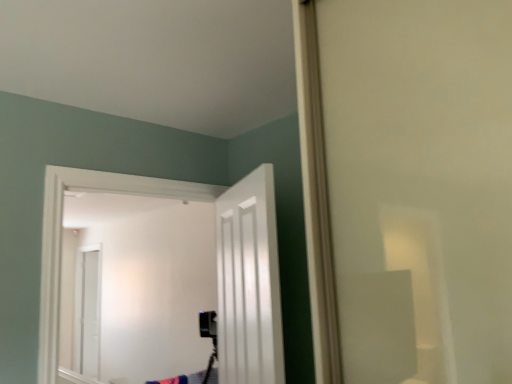
Question: From a real-world perspective, is white glossy door at center, the 1th door in the right-to-left sequence, located beneath white glossy door at center, the 2th door positioned from the right?

Choices:
 (A) yes
 (B) no

Answer: (A)

Question: Can you confirm if white glossy door at center, which appears as the second door when viewed from the left, is wider than white glossy door at center, the 2th door positioned from the right?

Choices:
 (A) no
 (B) yes

Answer: (A)

Question: Can you confirm if white glossy door at center, which appears as the second door when viewed from the left, is taller than white glossy door at center, the 2th door positioned from the right?

Choices:
 (A) yes
 (B) no

Answer: (B)

Question: From the image's perspective, is white glossy door at center, the 1th door in the right-to-left sequence, under white glossy door at center, the 2th door positioned from the right?

Choices:
 (A) no
 (B) yes

Answer: (A)

Question: Considering the relative sizes of white glossy door at center, which appears as the second door when viewed from the left, and white glossy door at center, which appears as the first door when viewed from the left, in the image provided, is white glossy door at center, which appears as the second door when viewed from the left, smaller than white glossy door at center, which appears as the first door when viewed from the left,?

Choices:
 (A) yes
 (B) no

Answer: (A)

Question: Is white glossy door at center, the 1th door in the right-to-left sequence, at the left side of white glossy door at center, which appears as the first door when viewed from the left?

Choices:
 (A) yes
 (B) no

Answer: (B)

Question: Is white glossy door at center, which appears as the first door when viewed from the left, smaller than white glossy door at center, which appears as the second door when viewed from the left?

Choices:
 (A) no
 (B) yes

Answer: (A)

Question: Could you tell me if white glossy door at center, which appears as the first door when viewed from the left, is turned towards white glossy door at center, the 1th door in the right-to-left sequence?

Choices:
 (A) yes
 (B) no

Answer: (A)

Question: Is white glossy door at center, the 2th door positioned from the right, far away from white glossy door at center, which appears as the second door when viewed from the left?

Choices:
 (A) yes
 (B) no

Answer: (A)

Question: Does white glossy door at center, which appears as the first door when viewed from the left, have a lesser width compared to white glossy door at center, the 1th door in the right-to-left sequence?

Choices:
 (A) no
 (B) yes

Answer: (A)

Question: From the image's perspective, is white glossy door at center, which appears as the first door when viewed from the left, located beneath white glossy door at center, the 1th door in the right-to-left sequence?

Choices:
 (A) no
 (B) yes

Answer: (B)

Question: From a real-world perspective, is white glossy door at center, which appears as the first door when viewed from the left, positioned over white glossy door at center, the 1th door in the right-to-left sequence, based on gravity?

Choices:
 (A) no
 (B) yes

Answer: (B)

Question: Considering the positions of white glossy door at center, which appears as the second door when viewed from the left, and white glossy door at center, the 2th door positioned from the right, in the image, is white glossy door at center, which appears as the second door when viewed from the left, bigger or smaller than white glossy door at center, the 2th door positioned from the right,?

Choices:
 (A) small
 (B) big

Answer: (A)